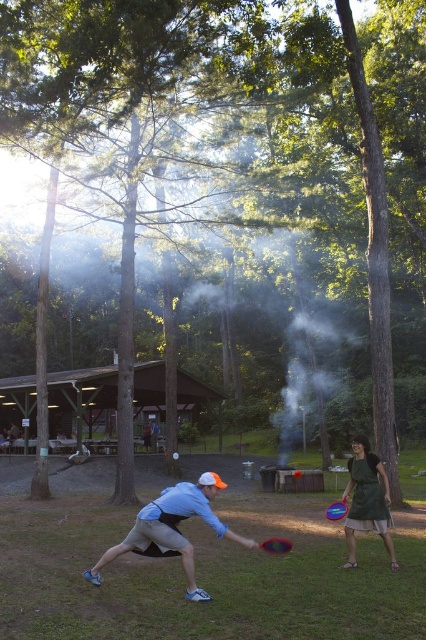
You are a badminton player standing at the point marked as point (178, 522). Your opponent is at the other end of the court. The court is 13.4 meters long. Can you reach the shuttlecock if it lands exactly halfway between you and your opponent?

Yes, because the distance between you and your opponent is 5.82 meters, so the halfway point is 2.91 meters away from you. Since a typical badminton player can reach up to 3 meters, you can reach it.

You are a photographer trying to capture a photo of the light blue fabric shirt at center and the red plastic frisbee at center in the scene. Which object should you focus on first if you want to ensure both are in sharp focus?

The light blue fabric shirt at center is smaller than the red plastic frisbee at center, so you should focus on the red plastic frisbee at center first to ensure both are in sharp focus.